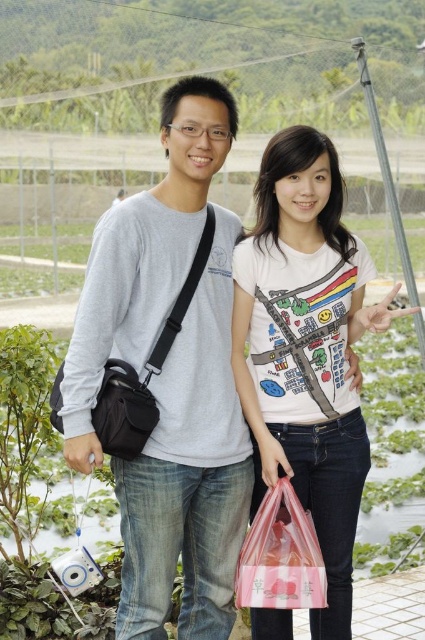
Question: Is the position of gray matte shirt at center less distant than that of matte black bag at left?

Choices:
 (A) no
 (B) yes

Answer: (A)

Question: Can you confirm if white printed t-shirt at center is positioned below black leather bag at left?

Choices:
 (A) yes
 (B) no

Answer: (A)

Question: Estimate the real-world distances between objects in this image. Which object is closer to the gray matte shirt at center?

Choices:
 (A) translucent plastic bag at lower center
 (B) black leather bag at left
 (C) matte black bag at left
 (D) white printed t-shirt at center

Answer: (B)

Question: Among these points, which one is nearest to the camera?

Choices:
 (A) (283, 541)
 (B) (110, 387)

Answer: (B)

Question: Can you confirm if gray matte shirt at center is positioned below matte black bag at left?

Choices:
 (A) no
 (B) yes

Answer: (A)

Question: Which point appears closest to the camera in this image?

Choices:
 (A) (116, 211)
 (B) (161, 362)
 (C) (305, 577)
 (D) (95, 419)

Answer: (C)